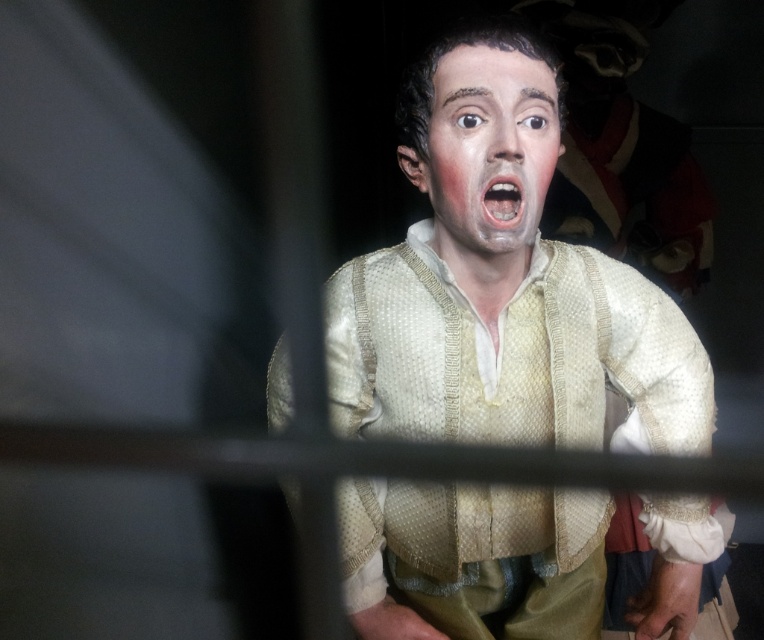
Question: Considering the real-world distances, which object is closest to the matte cream vest at center?

Choices:
 (A) matte white face at center
 (B) pink matte flesh at center

Answer: (A)

Question: Does matte cream vest at center appear on the left side of matte white face at center?

Choices:
 (A) yes
 (B) no

Answer: (B)

Question: Which of these objects is positioned closest to the matte cream vest at center?

Choices:
 (A) pink matte flesh at center
 (B) matte white face at center

Answer: (B)

Question: Is matte white face at center bigger than pink matte flesh at center?

Choices:
 (A) yes
 (B) no

Answer: (A)

Question: Is matte white face at center wider than pink matte flesh at center?

Choices:
 (A) no
 (B) yes

Answer: (B)

Question: Which point is closer to the camera?

Choices:
 (A) (529, 132)
 (B) (447, 371)
 (C) (484, 180)

Answer: (C)